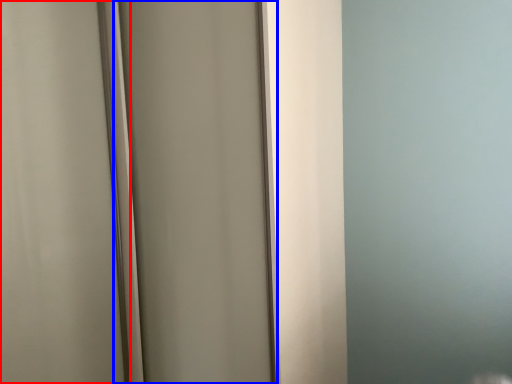
Question: Among these objects, which one is farthest to the camera, screen door (highlighted by a red box) or screen door (highlighted by a blue box)?

Choices:
 (A) screen door
 (B) screen door

Answer: (B)